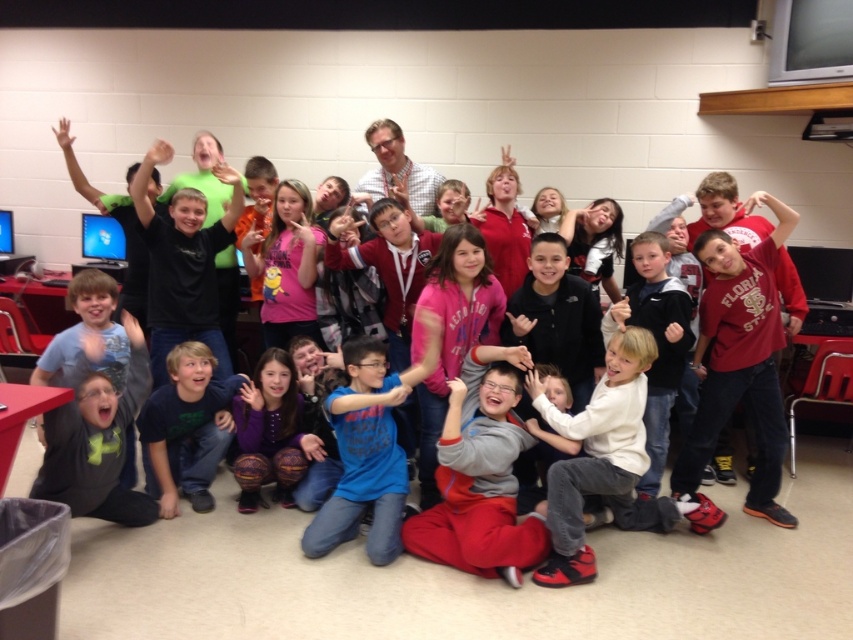
You are organizing a clothing donation drive and need to determine which item takes up more space horizontally. Based on the image, which item is wider between the white cotton shirt at center and the purple fuzzy socks at lower center?

The white cotton shirt at center is wider than the purple fuzzy socks at lower center.

You are a photographer setting up for a group photo. You notice the dark blue cotton shirt at lower left and the purple fuzzy socks at lower center. Which object has a greater width in the image?

The dark blue cotton shirt at lower left has a greater width than the purple fuzzy socks at lower center.

You are a photographer trying to capture a clear shot of the white cotton shirt at center and the purple fuzzy socks at lower center. Which object should you focus on first if you want to ensure both are in focus?

The white cotton shirt at center is positioned on the right side of purple fuzzy socks at lower center. Since they are positioned close to each other horizontally, focusing on either one should keep both in focus, but prioritizing the white cotton shirt at center might be better as it is central to the composition.